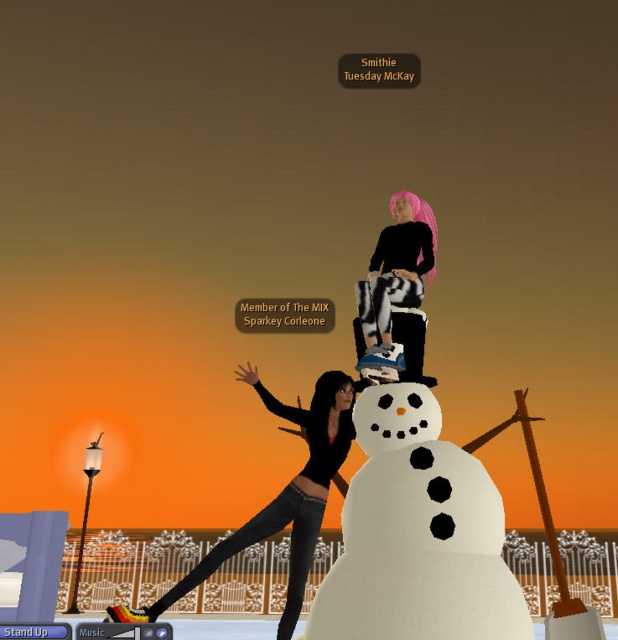
Does black matte pants at center have a lesser width compared to zebra-patterned pants at upper center?

No.

Does point (182, 580) come farther from viewer compared to point (397, 216)?

No, it is not.

Is point (197, 579) positioned in front of point (415, 275)?

Yes.

Identify the location of black matte pants at center. (281, 497).

Is point (357, 586) less distant than point (213, 554)?

Yes.

Is white fluffy snowman at center below black matte pants at center?

No, white fluffy snowman at center is not below black matte pants at center.

Between point (507, 579) and point (292, 611), which one is positioned behind?

Point (292, 611)

Where is `white fluffy snowman at center`? white fluffy snowman at center is located at coordinates (417, 536).

Does white fluffy snowman at center have a lesser height compared to zebra-patterned pants at upper center?

Indeed, white fluffy snowman at center has a lesser height compared to zebra-patterned pants at upper center.

In the scene shown: Is white fluffy snowman at center behind zebra-patterned pants at upper center?

No, it is in front of zebra-patterned pants at upper center.

Is point (353, 582) farther from viewer compared to point (378, 308)?

No.

Locate an element on the screen. Image resolution: width=618 pixels, height=640 pixels. white fluffy snowman at center is located at coordinates (417, 536).